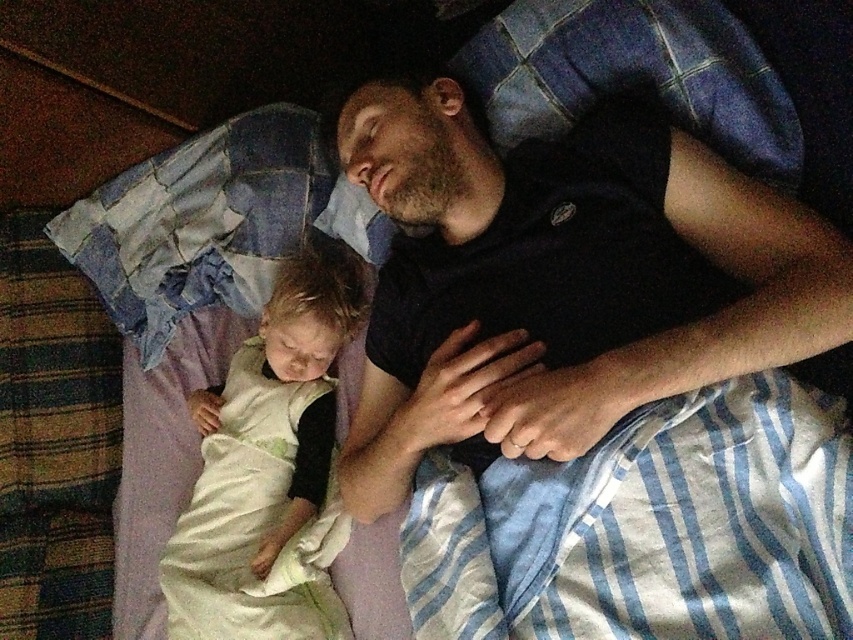
Question: Can you confirm if black matte shirt at upper right is positioned above soft white blanket at lower left?

Choices:
 (A) yes
 (B) no

Answer: (A)

Question: Considering the relative positions of black matte shirt at upper right and soft white blanket at lower left in the image provided, where is black matte shirt at upper right located with respect to soft white blanket at lower left?

Choices:
 (A) above
 (B) below

Answer: (A)

Question: Which point is closer to the camera?

Choices:
 (A) (604, 317)
 (B) (361, 296)

Answer: (A)

Question: Which point is farther to the camera?

Choices:
 (A) black matte shirt at upper right
 (B) soft white blanket at lower left

Answer: (B)

Question: Is black matte shirt at upper right smaller than soft white blanket at lower left?

Choices:
 (A) no
 (B) yes

Answer: (A)